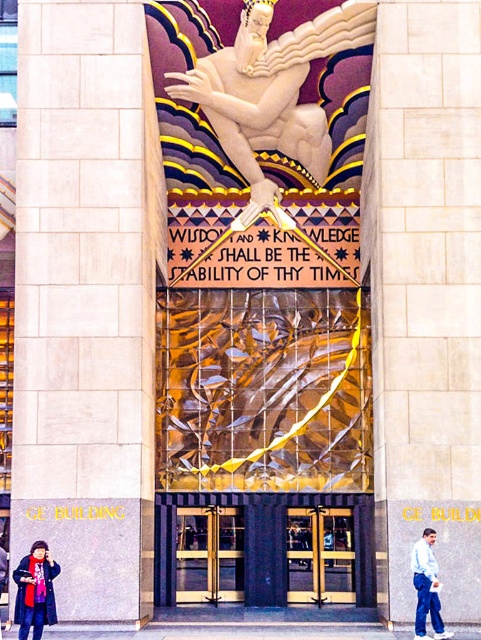
You are standing at the entrance of the GE Building and notice the beige stone pillar at left and the white marble statue at upper center. Which object is positioned higher up in the image?

The white marble statue at upper center is positioned higher up in the image than the beige stone pillar at left.

From the picture: You are a visitor at the GE Building entrance and want to take a photo of the white marble statue at upper center without any obstructions. Is the matte black coat at lower left blocking your view?

The matte black coat at lower left is behind the white marble statue at upper center, so it won not block your view of the white marble statue at upper center.

You are an architect designing a new building and want to ensure that the beige stone pillar at left and the gold polished metal doors at center are proportionate. Based on the image, which object should be scaled down to maintain the architectural harmony?

The beige stone pillar at left is taller than the gold polished metal doors at center, so to maintain architectural harmony, the beige stone pillar at left should be scaled down to match the height of the gold polished metal doors at center.